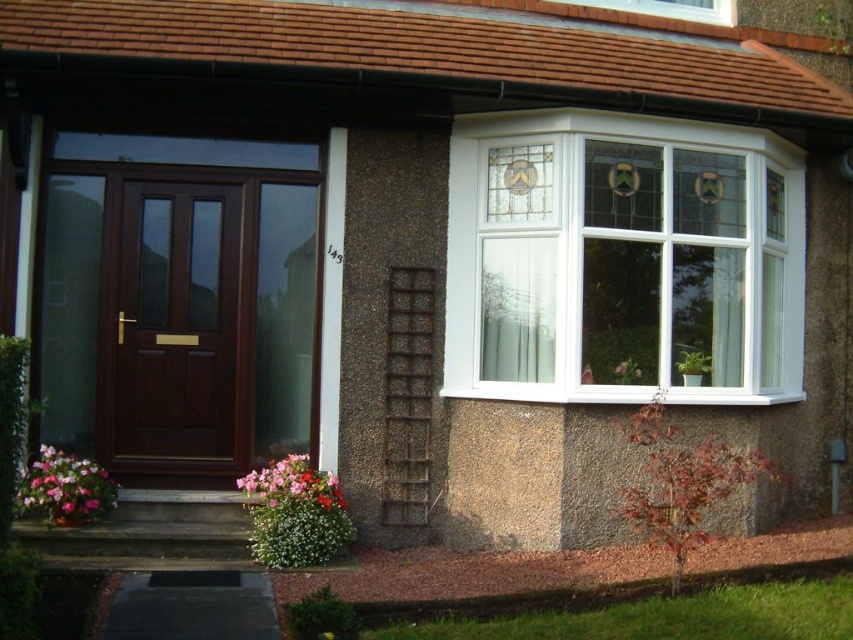
Who is more forward, (117, 294) or (297, 454)?

Positioned in front is point (117, 294).

Is matte brown door at center to the right of multicolored fabric flower at lower center from the viewer's perspective?

In fact, matte brown door at center is to the left of multicolored fabric flower at lower center.

Who is more distant from viewer, (x=233, y=218) or (x=338, y=490)?

Point (x=233, y=218)

I want to click on matte brown door at center, so click(175, 324).

Is white plastic bay window at upper right taller than matte brown door at center?

Correct, white plastic bay window at upper right is much taller as matte brown door at center.

Which is behind, point (480, 314) or point (181, 348)?

Positioned behind is point (480, 314).

At what (x,y) coordinates should I click in order to perform the action: click on white plastic bay window at upper right. Please return your answer as a coordinate pair (x, y). The height and width of the screenshot is (640, 853). Looking at the image, I should click on (622, 260).

Can you confirm if pink matte flower at lower left is wider than multicolored fabric flower at lower center?

Incorrect, pink matte flower at lower left's width does not surpass multicolored fabric flower at lower center's.

Is pink matte flower at lower left smaller than multicolored fabric flower at lower center?

Actually, pink matte flower at lower left might be larger than multicolored fabric flower at lower center.

The height and width of the screenshot is (640, 853). Identify the location of pink matte flower at lower left. click(x=64, y=486).

Find the location of a particular element. pink matte flower at lower left is located at coordinates (64, 486).